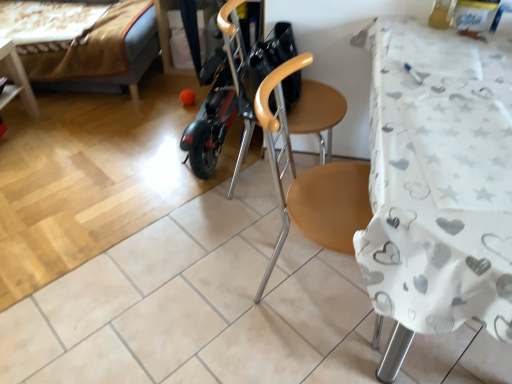
Question: Is velvet brown bed at upper left oriented away from wooden chair at center?

Choices:
 (A) no
 (B) yes

Answer: (A)

Question: From a real-world perspective, is velvet brown bed at upper left over wooden chair at center?

Choices:
 (A) yes
 (B) no

Answer: (B)

Question: Does velvet brown bed at upper left contain wooden chair at center?

Choices:
 (A) yes
 (B) no

Answer: (B)

Question: Can you confirm if velvet brown bed at upper left is wider than wooden chair at center?

Choices:
 (A) yes
 (B) no

Answer: (A)

Question: From a real-world perspective, is velvet brown bed at upper left positioned under wooden chair at center based on gravity?

Choices:
 (A) yes
 (B) no

Answer: (A)

Question: From a real-world perspective, relative to wooden chair at center, is white fabric-covered table at right vertically above or below?

Choices:
 (A) above
 (B) below

Answer: (A)

Question: Looking at their shapes, would you say white fabric-covered table at right is wider or thinner than wooden chair at center?

Choices:
 (A) thin
 (B) wide

Answer: (B)

Question: Is white fabric-covered table at right taller or shorter than wooden chair at center?

Choices:
 (A) tall
 (B) short

Answer: (B)

Question: Is white fabric-covered table at right bigger or smaller than wooden chair at center?

Choices:
 (A) small
 (B) big

Answer: (B)

Question: Considering the positions of wooden chair at center and wooden swivel chair at center in the image, is wooden chair at center wider or thinner than wooden swivel chair at center?

Choices:
 (A) thin
 (B) wide

Answer: (A)

Question: From the image's perspective, is wooden chair at center located above or below wooden swivel chair at center?

Choices:
 (A) below
 (B) above

Answer: (A)

Question: Considering the positions of wooden chair at center and wooden swivel chair at center in the image, is wooden chair at center taller or shorter than wooden swivel chair at center?

Choices:
 (A) tall
 (B) short

Answer: (A)

Question: Considering their positions, is wooden chair at center located in front of or behind wooden swivel chair at center?

Choices:
 (A) behind
 (B) front

Answer: (B)

Question: Considering the positions of velvet brown bed at upper left and wooden swivel chair at center in the image, is velvet brown bed at upper left bigger or smaller than wooden swivel chair at center?

Choices:
 (A) big
 (B) small

Answer: (A)

Question: Does point (140, 49) appear closer or farther from the camera than point (304, 130)?

Choices:
 (A) closer
 (B) farther

Answer: (B)